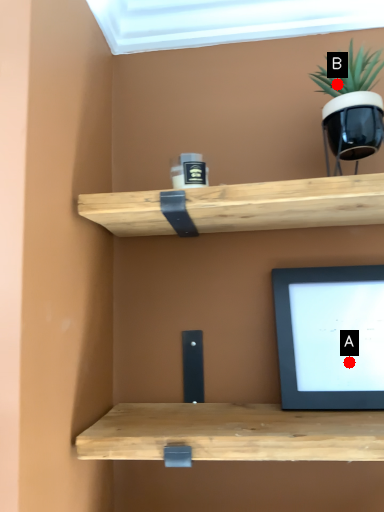
Question: Two points are circled on the image, labeled by A and B beside each circle. Which point is closer to the camera?

Choices:
 (A) A is closer
 (B) B is closer

Answer: (A)